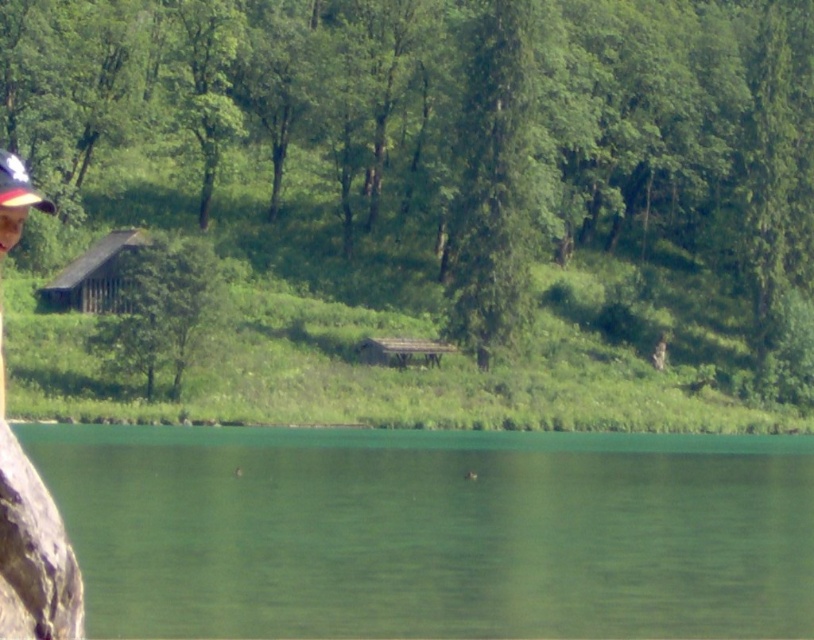
Looking at this image, which of these two, camouflage hat at left or white matte baseball cap at upper left, stands taller?

With more height is camouflage hat at left.

Between point (3, 397) and point (12, 192), which one is positioned behind?

Positioned behind is point (3, 397).

Locate an element on the screen. The width and height of the screenshot is (814, 640). camouflage hat at left is located at coordinates (15, 200).

Who is more forward, (620, 580) or (3, 225)?

Point (3, 225)

Is green liquid water at lower center closer to the viewer compared to camouflage hat at left?

That is False.

This screenshot has width=814, height=640. Identify the location of green liquid water at lower center. (432, 531).

Does point (143, 529) lie behind point (22, 202)?

Yes, it is behind point (22, 202).

Which is below, green liquid water at lower center or white matte baseball cap at upper left?

green liquid water at lower center is lower down.

Is point (511, 573) closer to camera compared to point (20, 182)?

No, it is not.

You are a GUI agent. You are given a task and a screenshot of the screen. Output one action in this format:
    pyautogui.click(x=<x>, y=<y>)
    Task: Click on the green liquid water at lower center
    
    Given the screenshot: What is the action you would take?
    pyautogui.click(x=432, y=531)